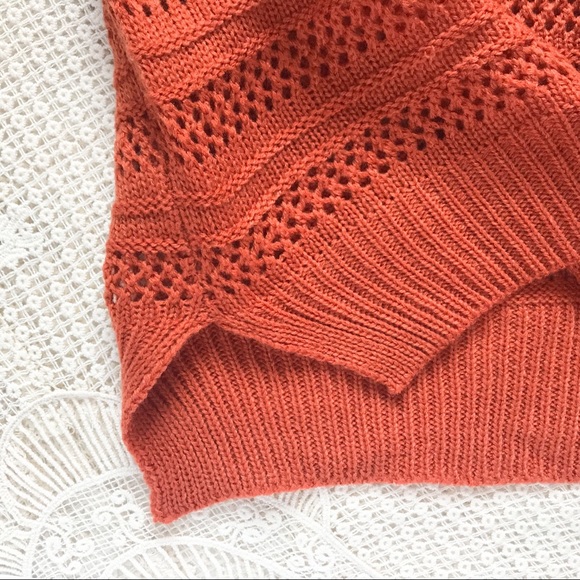
Image resolution: width=580 pixels, height=580 pixels. Identify the location of white crocheted blanket. (50, 85).